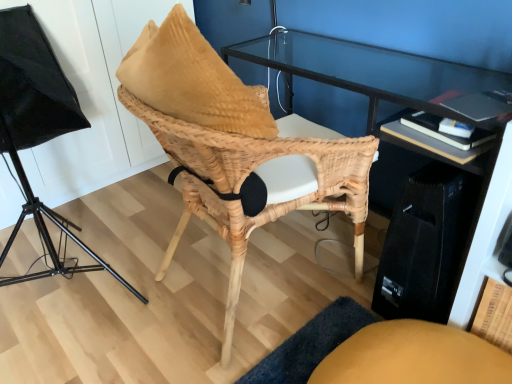
You are a GUI agent. You are given a task and a screenshot of the screen. Output one action in this format:
    pyautogui.click(x=<x>, y=<y>)
    Task: Click on the vacant space underneath natural woven chair at center (from a real-world perspective)
    This screenshot has height=384, width=512.
    Given the screenshot: What is the action you would take?
    pyautogui.click(x=260, y=284)